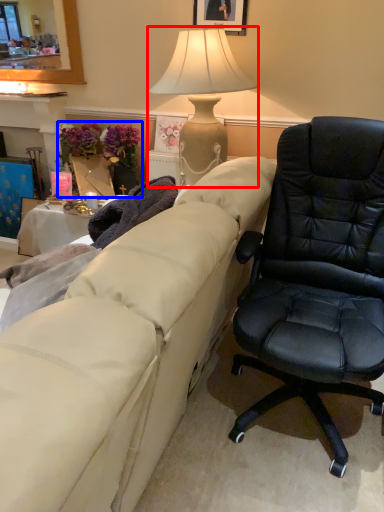
Question: Which of the following is the farthest to the observer, lamp (highlighted by a red box) or houseplant (highlighted by a blue box)?

Choices:
 (A) lamp
 (B) houseplant

Answer: (B)